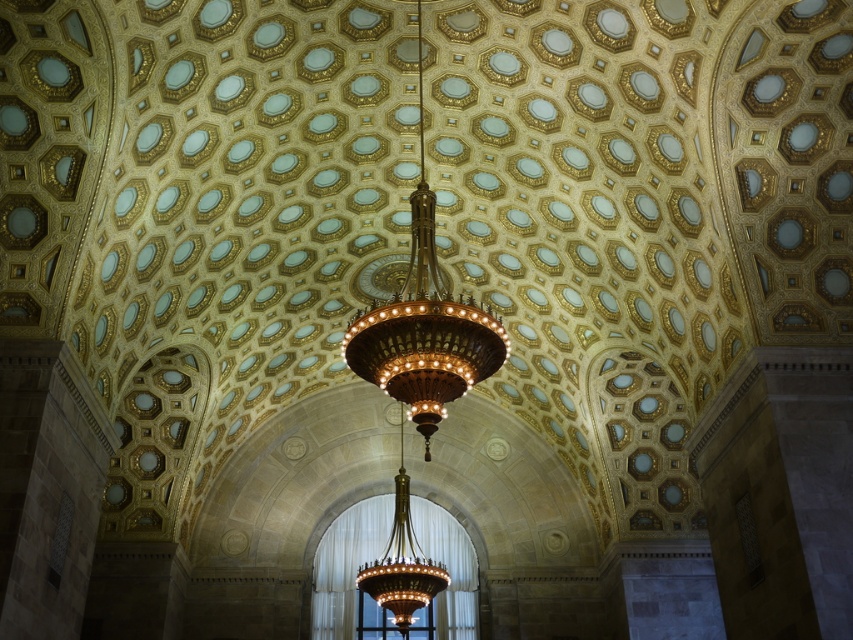
Question: In this image, where is polished brass chandelier at center located relative to gold metallic chandelier at center?

Choices:
 (A) below
 (B) above

Answer: (B)

Question: Which point is farther from the camera taking this photo?

Choices:
 (A) (407, 602)
 (B) (396, 296)

Answer: (B)

Question: In this image, where is polished brass chandelier at center located relative to gold metallic chandelier at center?

Choices:
 (A) right
 (B) left

Answer: (A)

Question: Which object is closer to the camera taking this photo?

Choices:
 (A) gold metallic chandelier at center
 (B) polished brass chandelier at center

Answer: (B)

Question: Is polished brass chandelier at center positioned behind gold metallic chandelier at center?

Choices:
 (A) yes
 (B) no

Answer: (B)

Question: Which object appears farthest from the camera in this image?

Choices:
 (A) gold metallic chandelier at center
 (B) polished brass chandelier at center

Answer: (A)